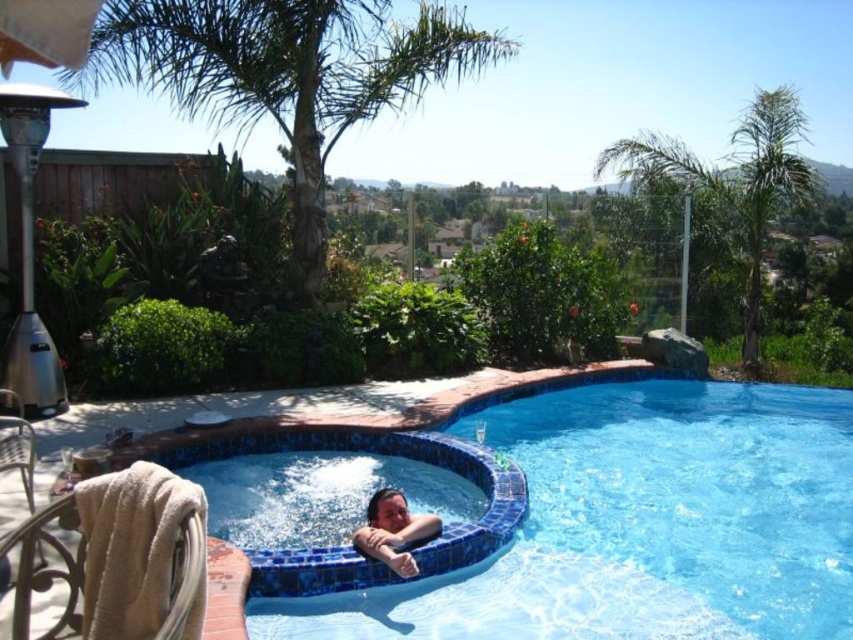
Can you confirm if blue mosaic tile swimming pool at center is positioned above smooth skin child at lower center?

No, blue mosaic tile swimming pool at center is not above smooth skin child at lower center.

Which is above, blue mosaic tile swimming pool at center or smooth skin child at lower center?

smooth skin child at lower center

Describe the element at coordinates (662, 422) in the screenshot. I see `blue mosaic tile swimming pool at center` at that location.

Image resolution: width=853 pixels, height=640 pixels. Identify the location of blue mosaic tile swimming pool at center. (662, 422).